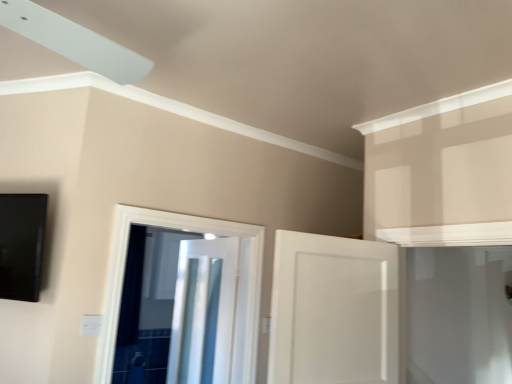
Question: Does white glossy door at center, positioned as the first door in front-to-back order, have a lesser height compared to white glossy door at center, which is the second door from front to back?

Choices:
 (A) yes
 (B) no

Answer: (A)

Question: Can you confirm if white glossy door at center, positioned as the first door in front-to-back order, is wider than white glossy door at center, which is the second door from front to back?

Choices:
 (A) yes
 (B) no

Answer: (B)

Question: Is white glossy door at center, arranged as the third door when viewed from the back, to the right of white glossy door at center, which is the second door from front to back, from the viewer's perspective?

Choices:
 (A) yes
 (B) no

Answer: (A)

Question: Considering the relative sizes of white glossy door at center, positioned as the first door in front-to-back order, and white glossy door at center, which is the 2th door from back to front, in the image provided, is white glossy door at center, positioned as the first door in front-to-back order, taller than white glossy door at center, which is the 2th door from back to front,?

Choices:
 (A) no
 (B) yes

Answer: (A)

Question: From the image's perspective, is white glossy door at center, positioned as the first door in front-to-back order, beneath white glossy door at center, which is the 2th door from back to front?

Choices:
 (A) no
 (B) yes

Answer: (A)

Question: Is white glossy door at center, arranged as the third door when viewed from the back, located outside white glossy door at center, which is the 2th door from back to front?

Choices:
 (A) yes
 (B) no

Answer: (A)

Question: Does white glossy door at center, which is the second door from front to back, appear on the right side of metallic silver door at center, the first door positioned from the back?

Choices:
 (A) yes
 (B) no

Answer: (A)

Question: Does white glossy door at center, which is the second door from front to back, have a lesser height compared to metallic silver door at center, the 3th door viewed from the front?

Choices:
 (A) yes
 (B) no

Answer: (A)

Question: Can you confirm if white glossy door at center, which is the second door from front to back, is positioned to the left of metallic silver door at center, the first door positioned from the back?

Choices:
 (A) yes
 (B) no

Answer: (B)

Question: Is the depth of white glossy door at center, which is the 2th door from back to front, greater than that of metallic silver door at center, the first door positioned from the back?

Choices:
 (A) no
 (B) yes

Answer: (A)

Question: Can you confirm if white glossy door at center, which is the 2th door from back to front, is bigger than metallic silver door at center, the first door positioned from the back?

Choices:
 (A) yes
 (B) no

Answer: (B)

Question: From the image's perspective, does white glossy door at center, which is the second door from front to back, appear higher than metallic silver door at center, the first door positioned from the back?

Choices:
 (A) yes
 (B) no

Answer: (A)

Question: Is white glossy door at center, which is the second door from front to back, next to white glossy door at center, positioned as the first door in front-to-back order?

Choices:
 (A) yes
 (B) no

Answer: (B)